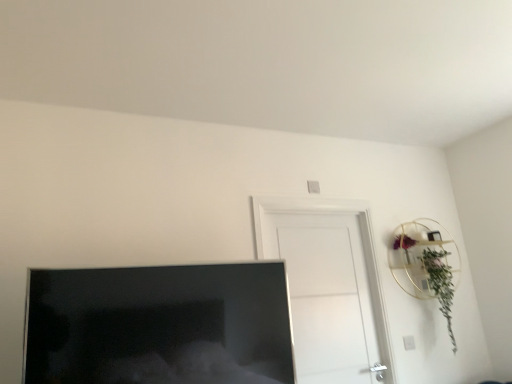
Question: Is point (444, 279) positioned closer to the camera than point (352, 382)?

Choices:
 (A) closer
 (B) farther

Answer: (B)

Question: From a real-world perspective, relative to white matte door at center, is green leafy plant at upper right vertically above or below?

Choices:
 (A) below
 (B) above

Answer: (A)

Question: Estimate the real-world distances between objects in this image. Which object is farther from the green leafy plant at upper right?

Choices:
 (A) white matte door at center
 (B) matte black tv at lower left

Answer: (B)

Question: Which of these objects is positioned farthest from the white matte door at center?

Choices:
 (A) green leafy plant at upper right
 (B) matte black tv at lower left

Answer: (B)